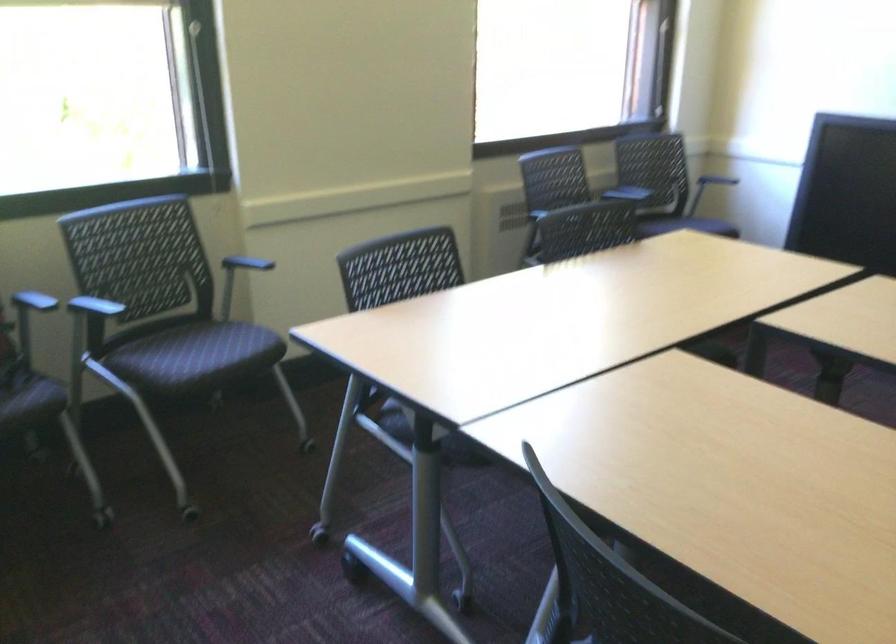
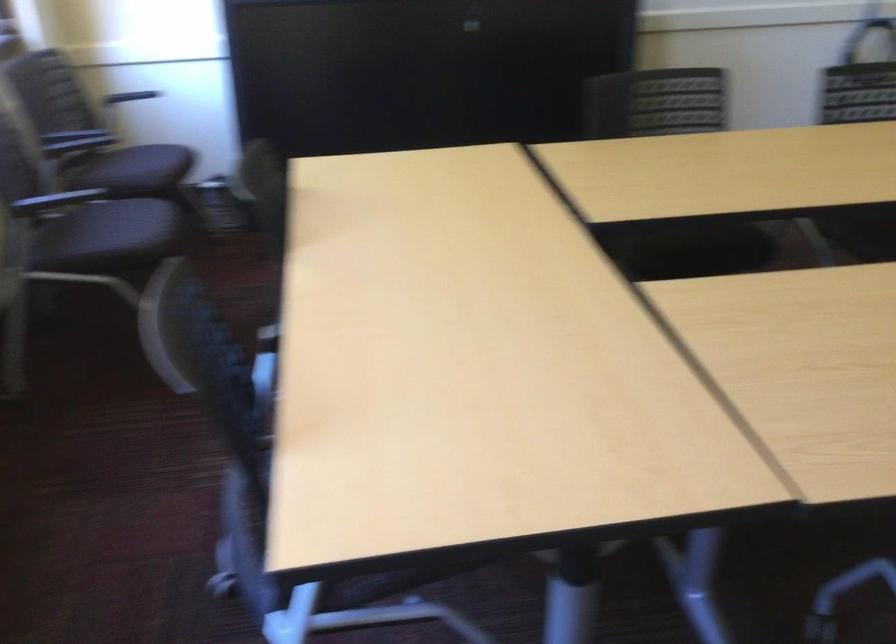
In the second image, find the point that corresponds to (x=661, y=223) in the first image.

(135, 169)